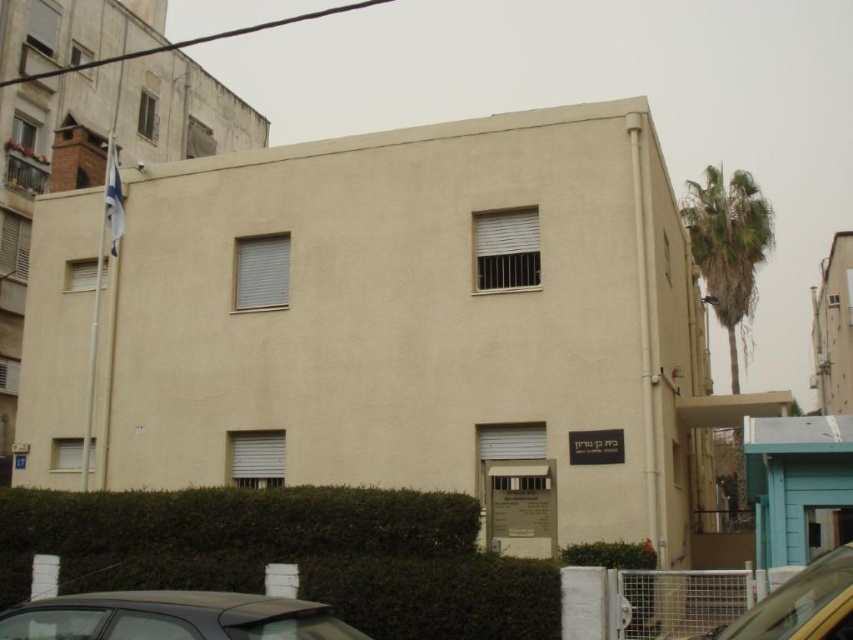
Does dark gray matte car at lower left appear on the right side of yellow matte car at lower right?

Incorrect, dark gray matte car at lower left is not on the right side of yellow matte car at lower right.

Does dark gray matte car at lower left have a greater height compared to yellow matte car at lower right?

Incorrect, dark gray matte car at lower left's height is not larger of yellow matte car at lower right's.

Image resolution: width=853 pixels, height=640 pixels. I want to click on dark gray matte car at lower left, so click(x=173, y=618).

Is dark gray matte car at lower left to the right of green leafy palm tree at upper right from the viewer's perspective?

Incorrect, dark gray matte car at lower left is not on the right side of green leafy palm tree at upper right.

Does dark gray matte car at lower left have a greater width compared to green leafy palm tree at upper right?

Incorrect, dark gray matte car at lower left's width does not surpass green leafy palm tree at upper right's.

The height and width of the screenshot is (640, 853). What do you see at coordinates (173, 618) in the screenshot?
I see `dark gray matte car at lower left` at bounding box center [173, 618].

Locate an element on the screen. dark gray matte car at lower left is located at coordinates (173, 618).

Can you confirm if green leafy palm tree at upper right is positioned below yellow matte car at lower right?

Incorrect, green leafy palm tree at upper right is not positioned below yellow matte car at lower right.

Is point (694, 204) positioned before point (834, 605)?

No.

The height and width of the screenshot is (640, 853). I want to click on green leafy palm tree at upper right, so click(728, 244).